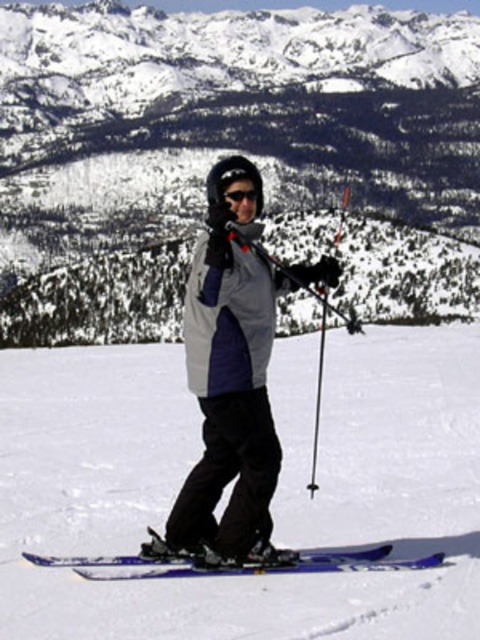
Question: Which point is closer to the camera?

Choices:
 (A) (116, 205)
 (B) (252, 193)

Answer: (B)

Question: Does blue metallic skis at center have a larger size compared to blue metallic skis at lower center?

Choices:
 (A) yes
 (B) no

Answer: (A)

Question: Estimate the real-world distances between objects in this image. Which object is closer to the blue metallic skis at center?

Choices:
 (A) white snow mountain at center
 (B) blue metallic skis at lower center
 (C) black matte goggles at center

Answer: (B)

Question: Which of the following is the closest to the observer?

Choices:
 (A) (411, 598)
 (B) (31, 554)
 (C) (262, 202)

Answer: (A)

Question: Does blue metallic skis at center have a greater width compared to black matte goggles at center?

Choices:
 (A) no
 (B) yes

Answer: (B)

Question: Observing the image, what is the correct spatial positioning of blue metallic skis at center in reference to black matte goggles at center?

Choices:
 (A) below
 (B) above

Answer: (A)